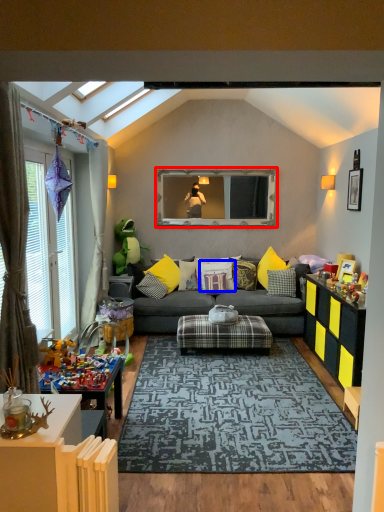
Question: Which object is closer to the camera taking this photo, window screen (highlighted by a red box) or pillow (highlighted by a blue box)?

Choices:
 (A) window screen
 (B) pillow

Answer: (B)